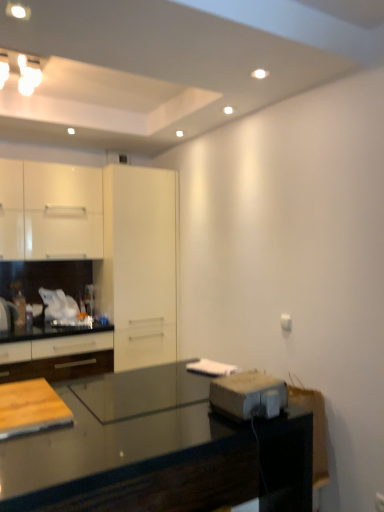
Question: Does white glossy cabinet at upper left, arranged as the 1th cabinetry when viewed from the top, appear on the right side of white glossy cabinets at left, the second cabinetry in the top-to-bottom sequence?

Choices:
 (A) no
 (B) yes

Answer: (A)

Question: Is white glossy cabinet at upper left, acting as the second cabinetry starting from the bottom, placed right next to white glossy cabinets at left, the 1th cabinetry when ordered from bottom to top?

Choices:
 (A) yes
 (B) no

Answer: (B)

Question: Is white glossy cabinet at upper left, arranged as the 1th cabinetry when viewed from the top, at the left side of white glossy cabinets at left, the second cabinetry in the top-to-bottom sequence?

Choices:
 (A) no
 (B) yes

Answer: (B)

Question: Would you say white glossy cabinet at upper left, arranged as the 1th cabinetry when viewed from the top, is a long distance from white glossy cabinets at left, the second cabinetry in the top-to-bottom sequence?

Choices:
 (A) yes
 (B) no

Answer: (B)

Question: Does white glossy cabinet at upper left, acting as the second cabinetry starting from the bottom, have a greater height compared to white glossy cabinets at left, the 1th cabinetry when ordered from bottom to top?

Choices:
 (A) no
 (B) yes

Answer: (A)

Question: Considering the positions of black glossy countertop at lower center and wooden cutting board at lower left in the image, is black glossy countertop at lower center bigger or smaller than wooden cutting board at lower left?

Choices:
 (A) small
 (B) big

Answer: (B)

Question: From a real-world perspective, is black glossy countertop at lower center above or below wooden cutting board at lower left?

Choices:
 (A) below
 (B) above

Answer: (A)

Question: From their relative heights in the image, would you say black glossy countertop at lower center is taller or shorter than wooden cutting board at lower left?

Choices:
 (A) tall
 (B) short

Answer: (A)

Question: Which is correct: black glossy countertop at lower center is inside wooden cutting board at lower left, or outside of it?

Choices:
 (A) inside
 (B) outside

Answer: (B)

Question: Is metallic gray toaster at lower right bigger or smaller than wooden cutting board at lower left?

Choices:
 (A) small
 (B) big

Answer: (A)

Question: Do you think metallic gray toaster at lower right is within wooden cutting board at lower left, or outside of it?

Choices:
 (A) outside
 (B) inside

Answer: (A)

Question: Relative to wooden cutting board at lower left, is metallic gray toaster at lower right in front or behind?

Choices:
 (A) behind
 (B) front

Answer: (A)

Question: Is metallic gray toaster at lower right taller or shorter than wooden cutting board at lower left?

Choices:
 (A) tall
 (B) short

Answer: (A)

Question: Considering the positions of white glossy cabinets at left, the second cabinetry in the top-to-bottom sequence, and metallic gray toaster at lower right in the image, is white glossy cabinets at left, the second cabinetry in the top-to-bottom sequence, wider or thinner than metallic gray toaster at lower right?

Choices:
 (A) thin
 (B) wide

Answer: (A)

Question: Is white glossy cabinets at left, the second cabinetry in the top-to-bottom sequence, spatially inside metallic gray toaster at lower right, or outside of it?

Choices:
 (A) inside
 (B) outside

Answer: (B)